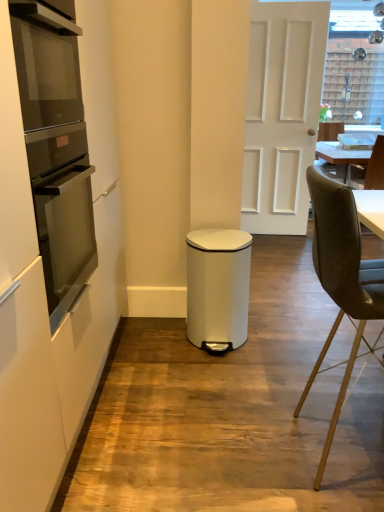
Identify the location of black leather chair at right, the first chair in the back-to-front sequence. The width and height of the screenshot is (384, 512). (369, 169).

Describe the element at coordinates (282, 113) in the screenshot. I see `white matte door at center` at that location.

The image size is (384, 512). What are the coordinates of `white matte waste bin at center` in the screenshot? It's located at (218, 288).

Image resolution: width=384 pixels, height=512 pixels. Find the location of `black leather chair at right, acting as the second chair starting from the front`. black leather chair at right, acting as the second chair starting from the front is located at coordinates (369, 169).

Is white matte door at center located outside leather-like brown chair at right, arranged as the first chair when viewed from the front?

Yes, white matte door at center is not within leather-like brown chair at right, arranged as the first chair when viewed from the front.

Is leather-like brown chair at right, the second chair viewed from the right, at the back of white matte door at center?

No, white matte door at center's orientation is not away from leather-like brown chair at right, the second chair viewed from the right.

In the scene shown: Is white matte door at center thinner than leather-like brown chair at right, which appears as the 1th chair when viewed from the left?

Correct, the width of white matte door at center is less than that of leather-like brown chair at right, which appears as the 1th chair when viewed from the left.

Is white matte door at center not close to leather-like brown chair at right, the second chair viewed from the right?

That's right, there is a large distance between white matte door at center and leather-like brown chair at right, the second chair viewed from the right.

From the image's perspective, does white matte waste bin at center appear higher than white matte cabinet at left?

No, from the image's perspective, white matte waste bin at center is not on top of white matte cabinet at left.

Which of these two, white matte waste bin at center or white matte cabinet at left, is wider?

With larger width is white matte cabinet at left.

This screenshot has width=384, height=512. I want to click on cabinetry that appears in front of the white matte waste bin at center, so click(44, 284).

Which point is more forward, (350,246) or (50,28)?

Point (350,246)

Can matte black oven at left be found inside leather-like brown chair at right, which appears as the 2th chair when viewed from the top?

Actually, matte black oven at left is outside leather-like brown chair at right, which appears as the 2th chair when viewed from the top.

In the scene shown: Which is more to the left, leather-like brown chair at right, which appears as the 1th chair when viewed from the left, or matte black oven at left?

matte black oven at left is more to the left.

Locate an element on the screen. the 2nd chair behind when counting from the matte black oven at left is located at coordinates (369, 169).

Is matte black oven at left next to black leather chair at right, positioned as the 1th chair in right-to-left order?

They are not placed beside each other.

Considering the relative sizes of matte black oven at left and black leather chair at right, the 1th chair positioned from the top, in the image provided, is matte black oven at left bigger than black leather chair at right, the 1th chair positioned from the top,?

Incorrect, matte black oven at left is not larger than black leather chair at right, the 1th chair positioned from the top.

Does point (57, 31) come farther from viewer compared to point (369, 159)?

No, (57, 31) is closer to viewer.

From the picture: Considering the sizes of white matte waste bin at center and white matte door at center in the image, is white matte waste bin at center bigger or smaller than white matte door at center?

In the image, white matte waste bin at center appears to be smaller than white matte door at center.

Can you confirm if white matte waste bin at center is positioned to the left of white matte door at center?

Indeed, white matte waste bin at center is positioned on the left side of white matte door at center.

From the image's perspective, which one is positioned lower, white matte waste bin at center or white matte door at center?

From the image's view, white matte waste bin at center is below.

Who is taller, white matte waste bin at center or white matte door at center?

Standing taller between the two is white matte door at center.

Can you tell me how much black leather chair at right, which is counted as the second chair, starting from the bottom, and white matte cabinet at left differ in facing direction?

The angular difference between black leather chair at right, which is counted as the second chair, starting from the bottom, and white matte cabinet at left is 91.5 degrees.

Considering the sizes of objects black leather chair at right, acting as the second chair starting from the front, and white matte cabinet at left in the image provided, who is smaller, black leather chair at right, acting as the second chair starting from the front, or white matte cabinet at left?

With smaller size is black leather chair at right, acting as the second chair starting from the front.

Can you confirm if black leather chair at right, the second chair when ordered from left to right, is positioned to the left of white matte cabinet at left?

No.

Is black leather chair at right, the second chair when ordered from left to right, taller than white matte cabinet at left?

In fact, black leather chair at right, the second chair when ordered from left to right, may be shorter than white matte cabinet at left.

Would you say leather-like brown chair at right, the second chair viewed from the right, contains white matte door at center?

No, leather-like brown chair at right, the second chair viewed from the right, does not contain white matte door at center.

Would you say leather-like brown chair at right, which appears as the 1th chair when viewed from the left, is to the left or to the right of white matte door at center in the picture?

leather-like brown chair at right, which appears as the 1th chair when viewed from the left, is to the left of white matte door at center.

Does leather-like brown chair at right, arranged as the first chair when ordered from the bottom, have a smaller size compared to white matte door at center?

Yes.

Which of these two, leather-like brown chair at right, positioned as the second chair in back-to-front order, or white matte door at center, stands taller?

white matte door at center.

Where is `door on the right of leather-like brown chair at right, positioned as the second chair in back-to-front order`? The height and width of the screenshot is (512, 384). door on the right of leather-like brown chair at right, positioned as the second chair in back-to-front order is located at coordinates (282, 113).

Find the location of a particular element. cabinetry that is in front of the white matte waste bin at center is located at coordinates (44, 284).

From the image, which object appears to be farther from white matte cabinet at left, white matte door at center or matte black oven at left?

The object further to white matte cabinet at left is white matte door at center.

Looking at the image, which one is located further to white matte waste bin at center, leather-like brown chair at right, the second chair viewed from the right, or black leather chair at right, which is counted as the second chair, starting from the bottom?

black leather chair at right, which is counted as the second chair, starting from the bottom, lies further to white matte waste bin at center than the other object.

Considering their positions, is white matte waste bin at center positioned closer to matte black oven at left than black leather chair at right, acting as the second chair starting from the front?

white matte waste bin at center.

From the image, which object appears to be farther from white matte cabinet at left, leather-like brown chair at right, arranged as the first chair when viewed from the front, or matte black oven at left?

Among the two, leather-like brown chair at right, arranged as the first chair when viewed from the front, is located further to white matte cabinet at left.

Which object lies further to the anchor point leather-like brown chair at right, arranged as the first chair when ordered from the bottom, matte black oven at left or black leather chair at right, acting as the second chair starting from the front?

Among the two, black leather chair at right, acting as the second chair starting from the front, is located further to leather-like brown chair at right, arranged as the first chair when ordered from the bottom.

Looking at this image, which object lies further to the anchor point leather-like brown chair at right, arranged as the first chair when viewed from the front, white matte cabinet at left or black leather chair at right, which is counted as the second chair, starting from the bottom?

Among the two, black leather chair at right, which is counted as the second chair, starting from the bottom, is located further to leather-like brown chair at right, arranged as the first chair when viewed from the front.

From the image, which object appears to be farther from matte black oven at left, black leather chair at right, the first chair in the back-to-front sequence, or leather-like brown chair at right, arranged as the first chair when viewed from the front?

Based on the image, black leather chair at right, the first chair in the back-to-front sequence, appears to be further to matte black oven at left.

When comparing their distances from white matte door at center, does black leather chair at right, the second chair when ordered from left to right, or white matte cabinet at left seem closer?

Based on the image, black leather chair at right, the second chair when ordered from left to right, appears to be nearer to white matte door at center.

This screenshot has height=512, width=384. In order to click on waste container between matte black oven at left and white matte door at center along the z-axis in this screenshot , I will do `click(218, 288)`.

Locate an element on the screen. The width and height of the screenshot is (384, 512). door positioned between matte black oven at left and black leather chair at right, which is counted as the second chair, starting from the bottom, from near to far is located at coordinates pos(282,113).

This screenshot has width=384, height=512. I want to click on door located between white matte cabinet at left and black leather chair at right, the second chair when ordered from left to right, in the depth direction, so click(x=282, y=113).

You are a GUI agent. You are given a task and a screenshot of the screen. Output one action in this format:
    pyautogui.click(x=<x>, y=<y>)
    Task: Click on the door between white matte waste bin at center and black leather chair at right, positioned as the 1th chair in right-to-left order, in the front-back direction
    The height and width of the screenshot is (512, 384).
    Given the screenshot: What is the action you would take?
    [282, 113]